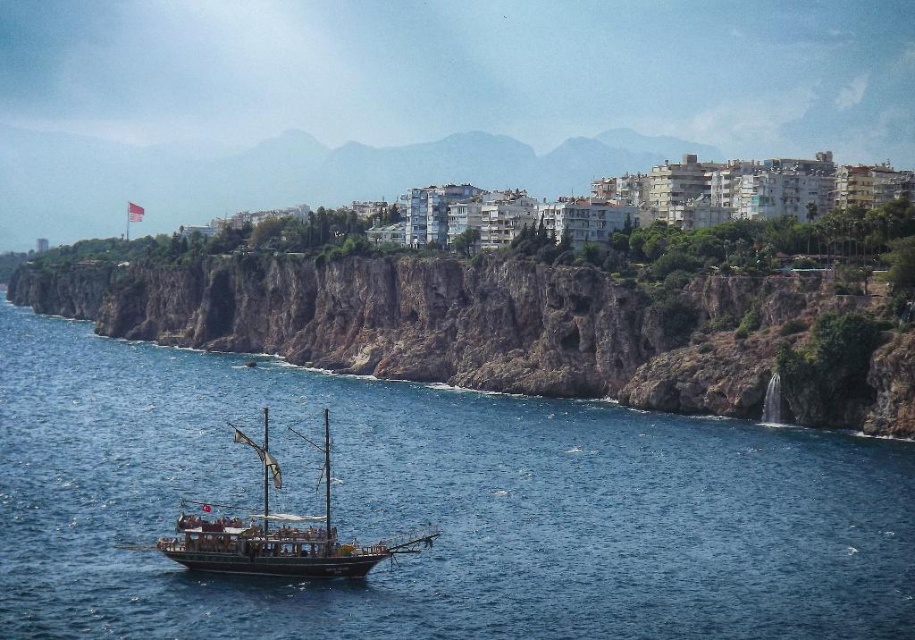
Question: Is blue water at center smaller than rugged rock cliff at center?

Choices:
 (A) no
 (B) yes

Answer: (B)

Question: From the image, what is the correct spatial relationship of rugged rock cliff at center in relation to wooden ship at center?

Choices:
 (A) left
 (B) right

Answer: (A)

Question: Estimate the real-world distances between objects in this image. Which object is closer to the wooden ship at center?

Choices:
 (A) rugged rock cliff at center
 (B) blue water at center

Answer: (B)

Question: Considering the real-world distances, which object is closest to the rugged rock cliff at center?

Choices:
 (A) blue water at center
 (B) wooden ship at center

Answer: (A)

Question: Which object appears closest to the camera in this image?

Choices:
 (A) rugged rock cliff at center
 (B) wooden ship at center

Answer: (B)

Question: Is the position of blue water at center less distant than that of rugged rock cliff at center?

Choices:
 (A) no
 (B) yes

Answer: (B)